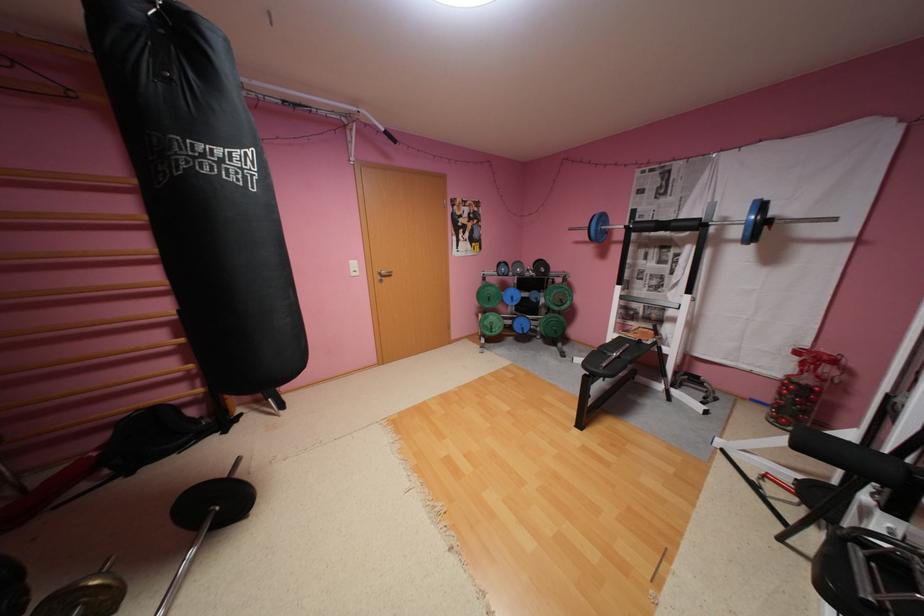
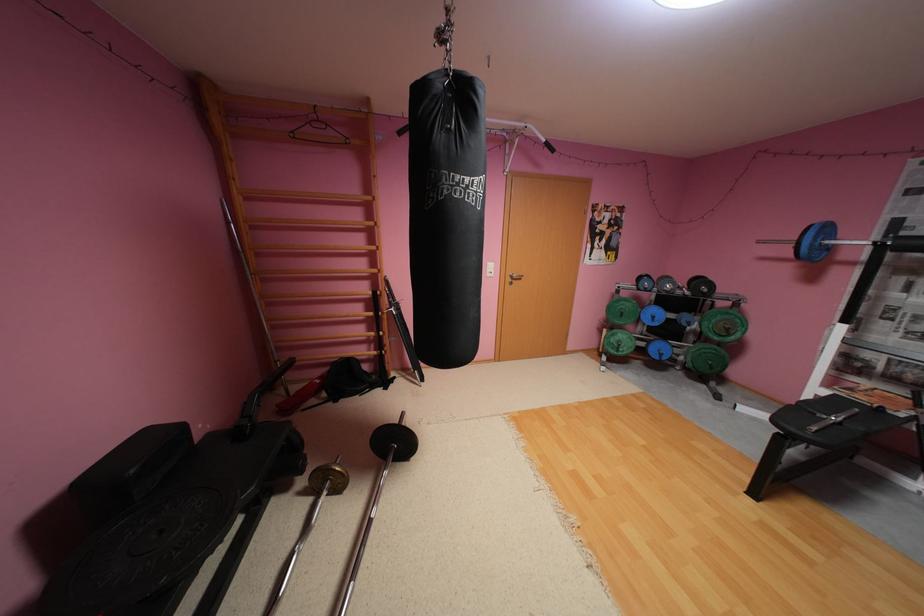
Where in the second image is the point corresponding to [386,130] from the first image?

(544, 140)